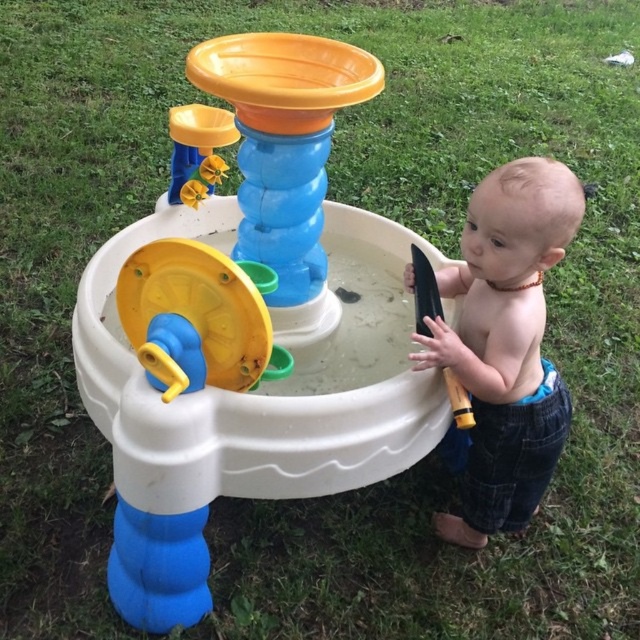
Does white plastic water table at center have a larger size compared to smooth tan skin at right?

Yes.

Does white plastic water table at center have a lesser height compared to smooth tan skin at right?

In fact, white plastic water table at center may be taller than smooth tan skin at right.

Between point (243, 81) and point (502, 468), which one is positioned behind?

The point (502, 468) is more distant.

Find the location of `white plastic water table at center`. white plastic water table at center is located at coordinates [248, 324].

Is white plastic water table at center wider than yellow plastic wheel at center?

Correct, the width of white plastic water table at center exceeds that of yellow plastic wheel at center.

Does white plastic water table at center appear over yellow plastic wheel at center?

Yes, white plastic water table at center is above yellow plastic wheel at center.

Which is behind, point (356, 72) or point (221, 317)?

The point (356, 72) is behind.

The height and width of the screenshot is (640, 640). I want to click on white plastic water table at center, so click(248, 324).

Can you confirm if smooth tan skin at right is positioned above yellow plastic wheel at center?

Incorrect, smooth tan skin at right is not positioned above yellow plastic wheel at center.

From the picture: Does smooth tan skin at right appear on the left side of yellow plastic wheel at center?

Incorrect, smooth tan skin at right is not on the left side of yellow plastic wheel at center.

Does point (532, 234) lie behind point (257, 312)?

Yes, point (532, 234) is behind point (257, 312).

Where is `smooth tan skin at right`? smooth tan skin at right is located at coordinates (506, 342).